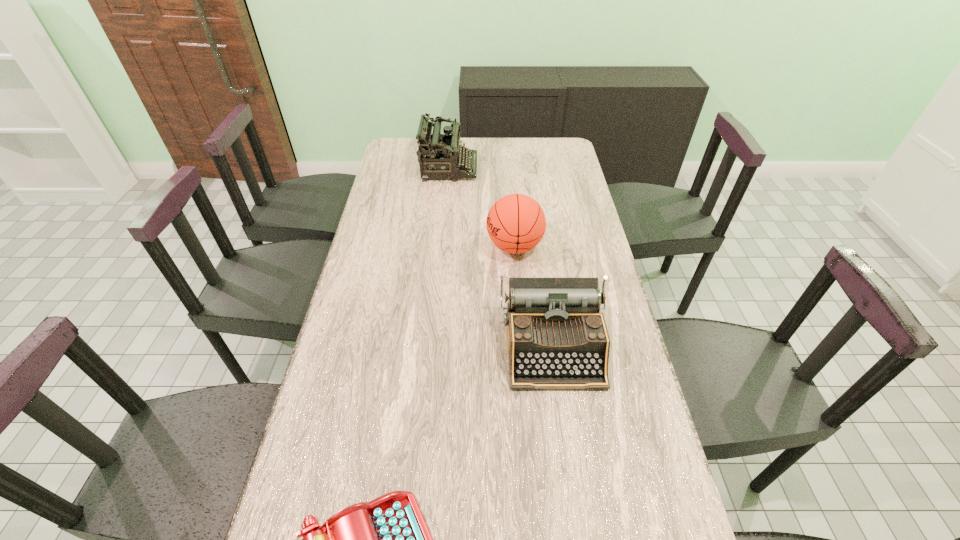
You are a GUI agent. You are given a task and a screenshot of the screen. Output one action in this format:
    pyautogui.click(x=<x>, y=<y>)
    Task: Click on the object present at the far edge
    This screenshot has height=540, width=960.
    Given the screenshot: What is the action you would take?
    pyautogui.click(x=444, y=154)

At what (x,y) coordinates should I click in order to perform the action: click on object present at the left edge. Please return your answer as a coordinate pair (x, y). This screenshot has height=540, width=960. Looking at the image, I should click on click(444, 154).

You are a GUI agent. You are given a task and a screenshot of the screen. Output one action in this format:
    pyautogui.click(x=<x>, y=<y>)
    Task: Click on the object present at the right edge
    
    Given the screenshot: What is the action you would take?
    pyautogui.click(x=557, y=338)

At what (x,y) coordinates should I click in order to perform the action: click on object that is at the far left corner. Please return your answer as a coordinate pair (x, y). Looking at the image, I should click on (444, 154).

The height and width of the screenshot is (540, 960). Identify the location of vacant region at the far edge. (523, 155).

In the image, there is a desktop. Identify the location of vacant space at the left edge. The height and width of the screenshot is (540, 960). (399, 259).

I want to click on vacant space at the right edge of the desktop, so click(556, 258).

Identify the location of free space between the farthest object and the third nearest object. (482, 207).

This screenshot has width=960, height=540. What are the coordinates of `vacant area that lies between the farthest typewriter and the basketball` in the screenshot? It's located at (482, 207).

The height and width of the screenshot is (540, 960). I want to click on free area in between the third farthest object and the farthest typewriter, so click(501, 258).